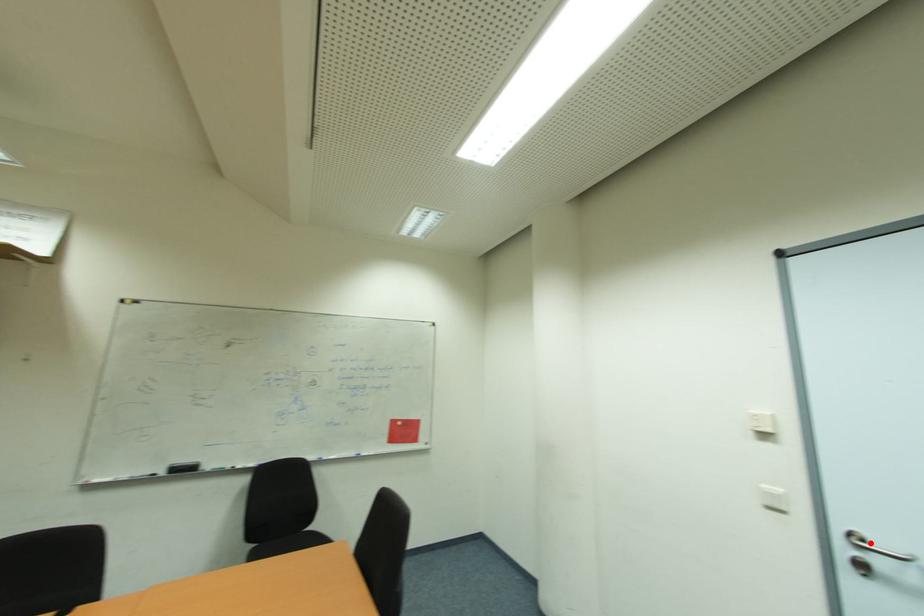
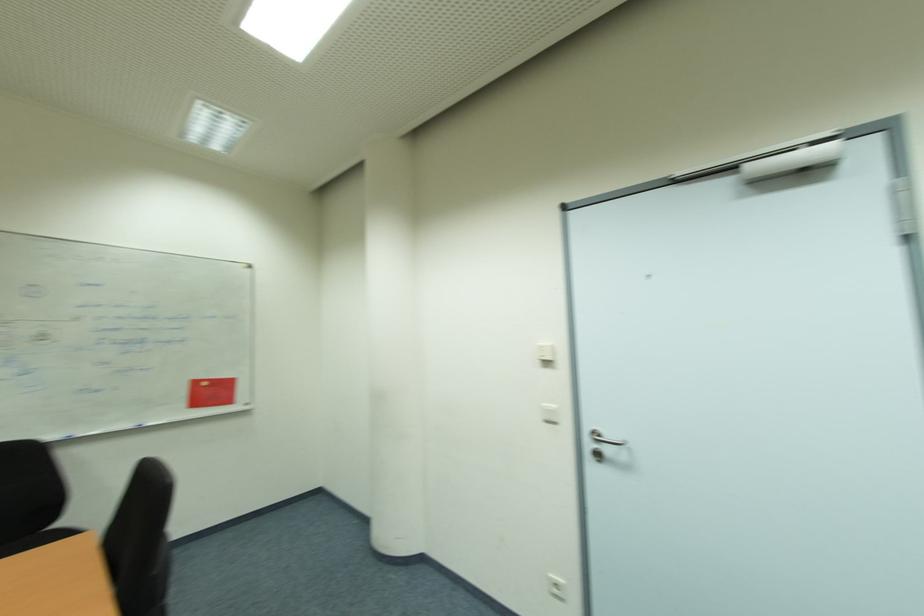
Question: I am providing you with two images of the same scene from different viewpoints. Image1 has a red point marked. In image2, the corresponding 3D location appears at what relative position? Reply with the corresponding letter.

Choices:
 (A) Closer
 (B) Farther

Answer: (B)